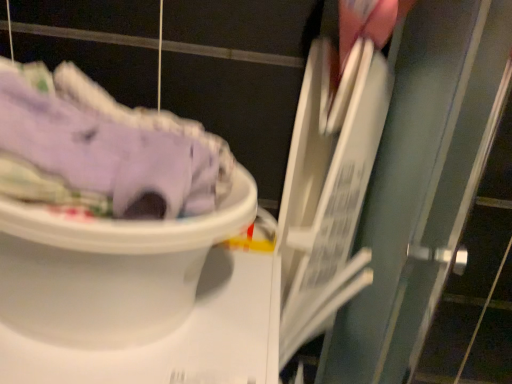
Question: Is purple cotton pants at left next to white plastic toilet at lower left?

Choices:
 (A) no
 (B) yes

Answer: (A)

Question: From a real-world perspective, is purple cotton pants at left on white plastic toilet at lower left?

Choices:
 (A) yes
 (B) no

Answer: (A)

Question: Does purple cotton pants at left have a smaller size compared to white plastic toilet at lower left?

Choices:
 (A) no
 (B) yes

Answer: (B)

Question: Can you confirm if purple cotton pants at left is shorter than white plastic toilet at lower left?

Choices:
 (A) no
 (B) yes

Answer: (B)

Question: Does purple cotton pants at left appear on the right side of white plastic toilet at lower left?

Choices:
 (A) yes
 (B) no

Answer: (A)

Question: Is purple cotton pants at left at the left side of white plastic toilet at lower left?

Choices:
 (A) yes
 (B) no

Answer: (B)

Question: Is white plastic toilet at lower left shorter than purple cotton pants at left?

Choices:
 (A) no
 (B) yes

Answer: (A)

Question: From a real-world perspective, is white plastic toilet at lower left on top of purple cotton pants at left?

Choices:
 (A) no
 (B) yes

Answer: (A)

Question: Does white plastic toilet at lower left turn towards purple cotton pants at left?

Choices:
 (A) no
 (B) yes

Answer: (A)

Question: Is white plastic toilet at lower left far away from purple cotton pants at left?

Choices:
 (A) no
 (B) yes

Answer: (A)

Question: Considering the relative sizes of white plastic toilet at lower left and purple cotton pants at left in the image provided, is white plastic toilet at lower left thinner than purple cotton pants at left?

Choices:
 (A) no
 (B) yes

Answer: (A)

Question: Is the position of white plastic toilet at lower left more distant than that of purple cotton pants at left?

Choices:
 (A) no
 (B) yes

Answer: (B)

Question: From the image's perspective, is white plastic toilet at lower left above or below purple cotton pants at left?

Choices:
 (A) below
 (B) above

Answer: (A)